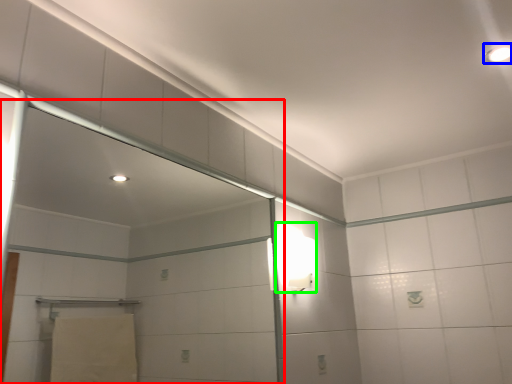
Question: Which object is the closest to the screen door (highlighted by a red box)? Choose among these: light fixture (highlighted by a blue box) or light fixture (highlighted by a green box).

Choices:
 (A) light fixture
 (B) light fixture

Answer: (B)